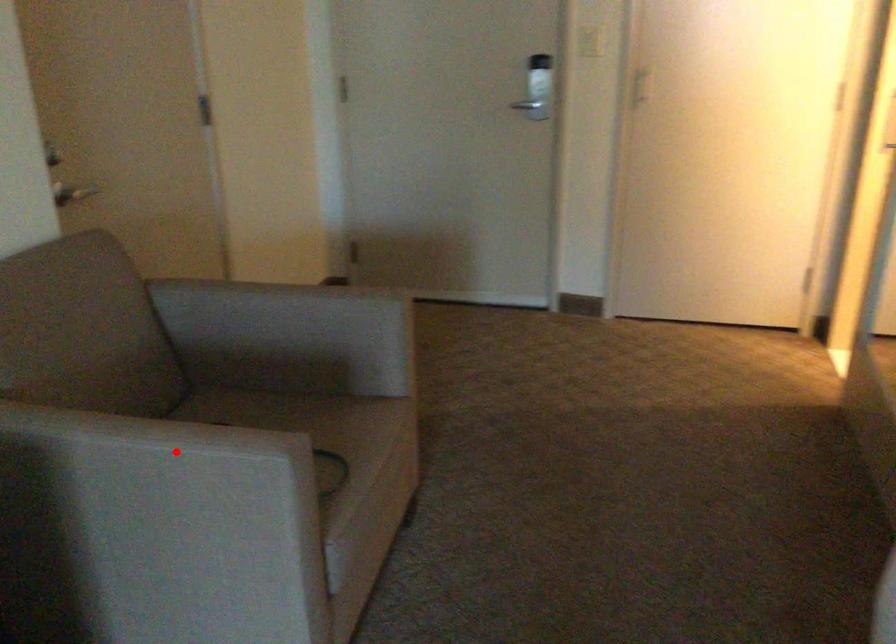
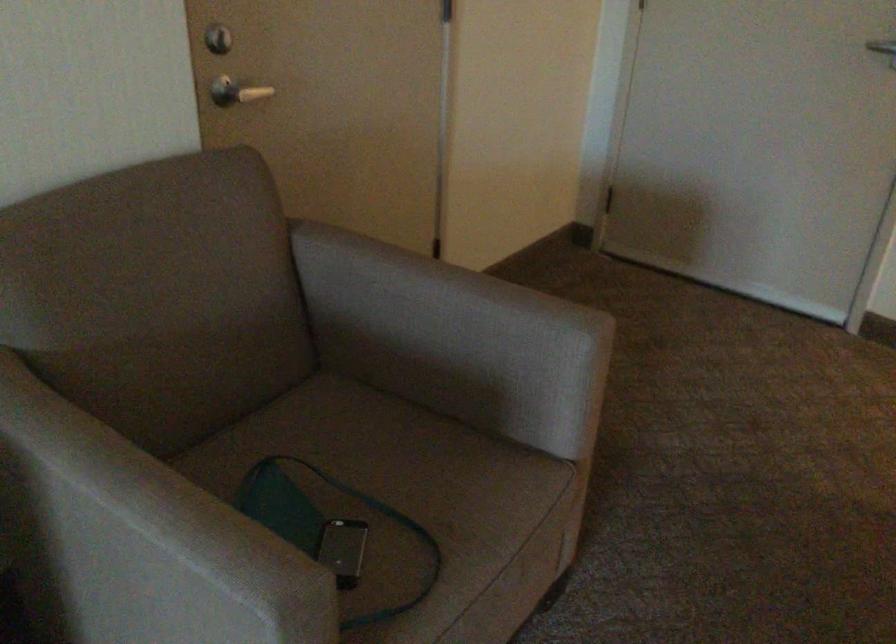
Question: A red point is marked in image1. In image2, is the corresponding 3D point closer to the camera or farther? Reply with the corresponding letter.

Choices:
 (A) The corresponding 3D point is closer.
 (B) The corresponding 3D point is farther.

Answer: (A)